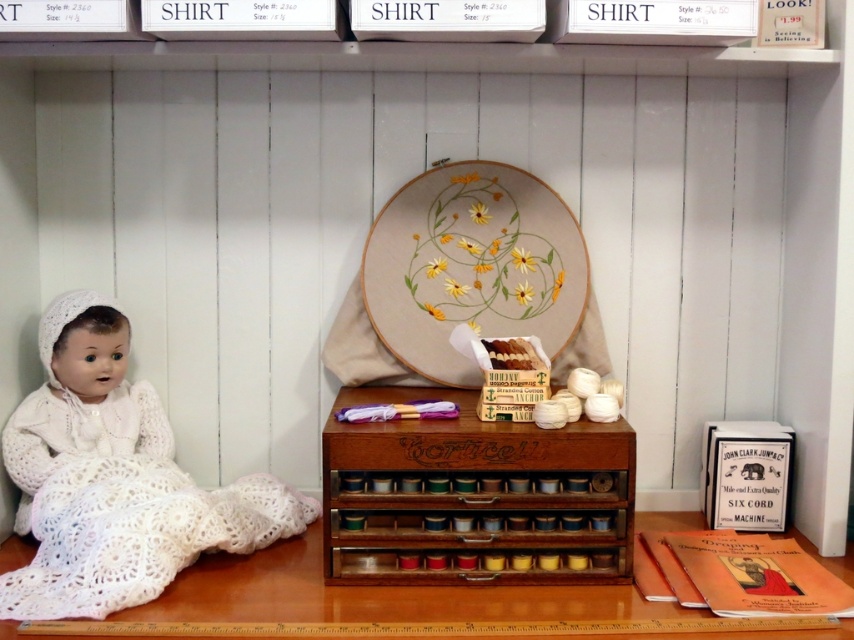
Is white crocheted dress at left to the left of wooden table at lower center from the viewer's perspective?

Yes, white crocheted dress at left is to the left of wooden table at lower center.

Who is more distant from viewer, (54, 563) or (369, 586)?

Positioned behind is point (369, 586).

Where is `white crocheted dress at left`? The width and height of the screenshot is (854, 640). white crocheted dress at left is located at coordinates (123, 508).

Consider the image. Is wooden spool rack at center smaller than wooden table at lower center?

Indeed, wooden spool rack at center has a smaller size compared to wooden table at lower center.

Find the location of a particular element. wooden spool rack at center is located at coordinates (474, 497).

This screenshot has height=640, width=854. What are the coordinates of `wooden spool rack at center` in the screenshot? It's located at (474, 497).

How far apart are wooden spool rack at center and white crocheted dress at left?

A: wooden spool rack at center and white crocheted dress at left are 10.15 inches apart from each other.

Who is shorter, wooden spool rack at center or white crocheted dress at left?

wooden spool rack at center

The height and width of the screenshot is (640, 854). What are the coordinates of `wooden spool rack at center` in the screenshot? It's located at (474, 497).

Find the location of a particular element. Image resolution: width=854 pixels, height=640 pixels. wooden spool rack at center is located at coordinates (474, 497).